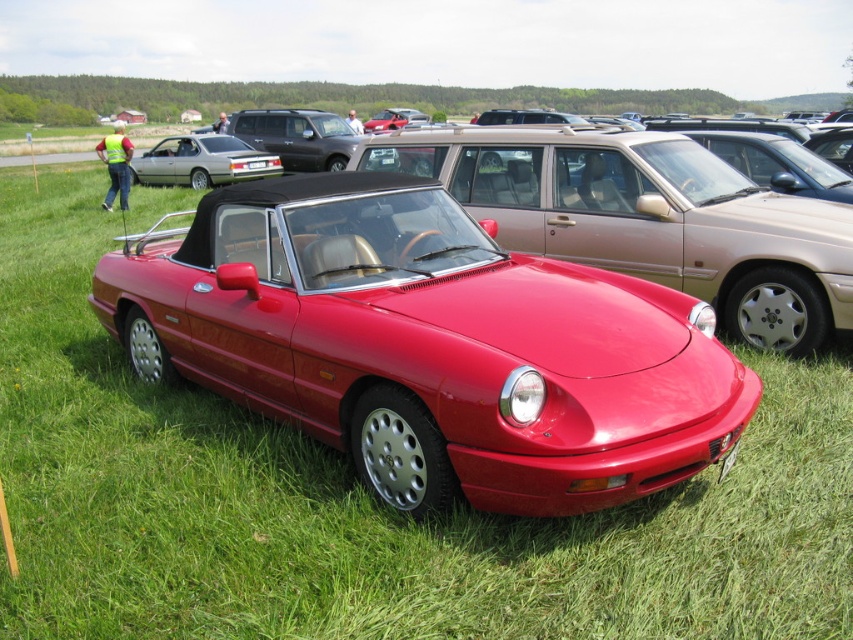
Is point (142, 173) farther from camera compared to point (251, 163)?

That is True.

Which is more to the left, silver metallic sedan at center or white plastic license plate at center?

silver metallic sedan at center

Is point (223, 173) farther from viewer compared to point (247, 164)?

That is False.

This screenshot has width=853, height=640. What are the coordinates of `silver metallic sedan at center` in the screenshot? It's located at (200, 161).

Can you confirm if glossy red convertible at center is smaller than silver metallic sedan at center?

Correct, glossy red convertible at center occupies less space than silver metallic sedan at center.

Is glossy red convertible at center further to the viewer compared to silver metallic sedan at center?

That is False.

Which is in front, point (405, 428) or point (254, 156)?

Point (405, 428) is in front.

Find the location of a particular element. The width and height of the screenshot is (853, 640). glossy red convertible at center is located at coordinates (428, 346).

Is shiny red convertible at center to the left of silver metallic sedan at center from the viewer's perspective?

No, shiny red convertible at center is not to the left of silver metallic sedan at center.

Is point (546, 129) more distant than point (183, 172)?

That is False.

You are a GUI agent. You are given a task and a screenshot of the screen. Output one action in this format:
    pyautogui.click(x=<x>, y=<y>)
    Task: Click on the shiny red convertible at center
    This screenshot has height=640, width=853.
    Given the screenshot: What is the action you would take?
    pyautogui.click(x=647, y=218)

This screenshot has height=640, width=853. Identify the location of shiny red convertible at center. (647, 218).